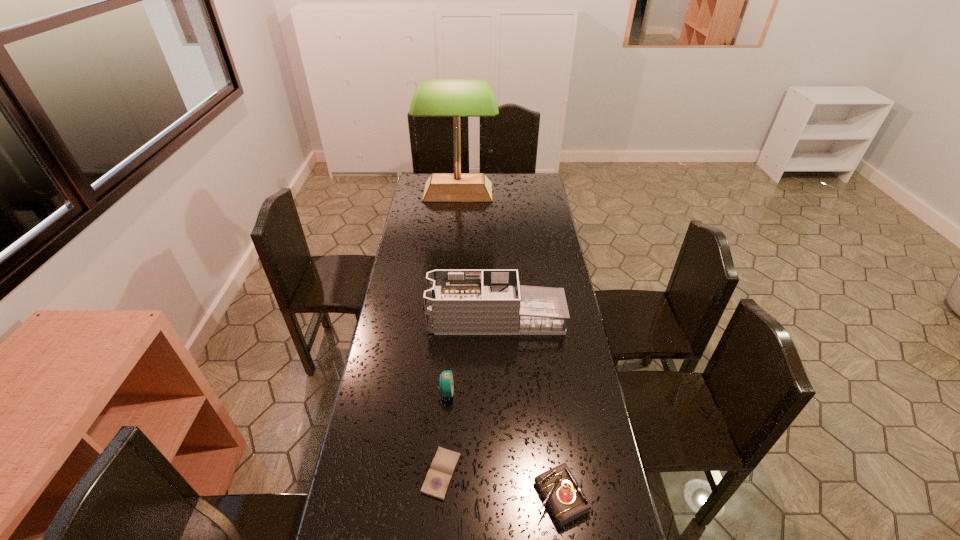
I want to click on free space between the third tallest object and the shorter diary, so click(x=444, y=433).

The height and width of the screenshot is (540, 960). I want to click on unoccupied position between the right diary and the left diary, so click(501, 485).

At what (x,y) coordinates should I click in order to perform the action: click on vacant region between the taller diary and the farthest object. Please return your answer as a coordinate pair (x, y). The height and width of the screenshot is (540, 960). Looking at the image, I should click on (510, 345).

At what (x,y) coordinates should I click in order to perform the action: click on the closest object relative to the fourth shortest object. Please return your answer as a coordinate pair (x, y). This screenshot has height=540, width=960. Looking at the image, I should click on (446, 381).

What are the coordinates of `object that is the second closest one to the left diary` in the screenshot? It's located at (566, 500).

Identify the location of free space in the image that satisfies the following two spatial constraints: 1. on the front-facing side of the shorter diary; 2. on the right side of the third farthest object. The width and height of the screenshot is (960, 540). (441, 474).

Identify the location of vacant space that satisfies the following two spatial constraints: 1. on the metallic stand of the farthest object; 2. on the left side of the left diary. This screenshot has width=960, height=540. coord(438,474).

This screenshot has height=540, width=960. What are the coordinates of `vacant space that satisfies the following two spatial constraints: 1. at the entrance of the dollhouse; 2. on the right side of the taller diary` in the screenshot? It's located at (503, 497).

Locate an element on the screen. vacant region that satisfies the following two spatial constraints: 1. at the entrance of the second shortest object; 2. on the left side of the dollhouse is located at coordinates (503, 497).

Locate an element on the screen. This screenshot has height=540, width=960. vacant space that satisfies the following two spatial constraints: 1. on the back side of the second shortest object; 2. on the front-facing side of the third farthest object is located at coordinates (547, 392).